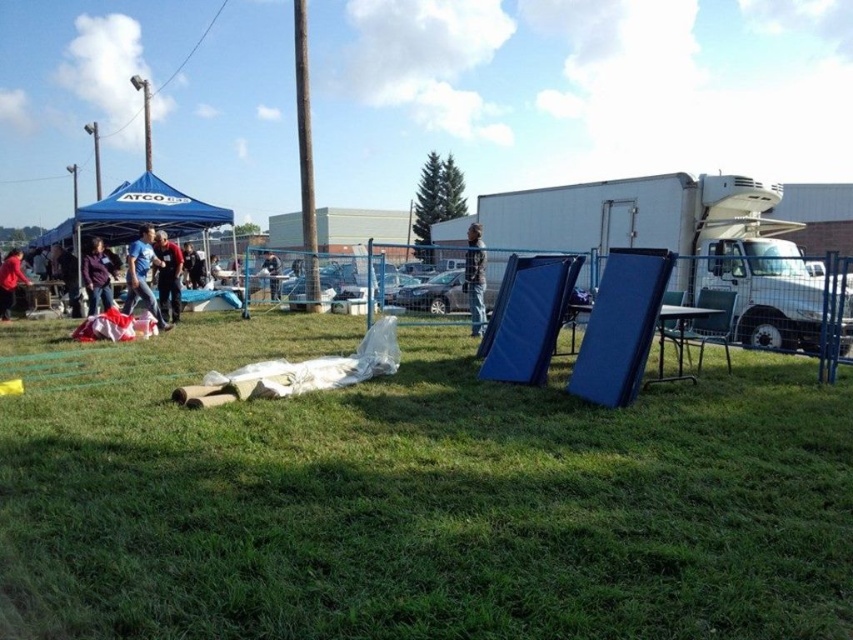
Between green plastic chair at center and dark blue jeans at center, which one appears on the left side from the viewer's perspective?

From the viewer's perspective, dark blue jeans at center appears more on the left side.

Measure the distance between point (692,326) and camera.

A distance of 7.85 meters exists between point (692,326) and camera.

Find the location of `green plastic chair at center`. green plastic chair at center is located at coordinates (701, 324).

Is blue fabric at left to the left of matte black jacket at left from the viewer's perspective?

No, blue fabric at left is not to the left of matte black jacket at left.

Which is behind, point (142, 253) or point (56, 243)?

Positioned behind is point (56, 243).

Identify the location of blue fabric at left. (142, 275).

Is point (740, 508) closer to viewer compared to point (474, 224)?

Yes, point (740, 508) is closer to viewer.

Can you confirm if green grassy at center is positioned to the left of blue plaid shirt at center?

Correct, you'll find green grassy at center to the left of blue plaid shirt at center.

Is point (309, 616) positioned behind point (468, 243)?

No.

This screenshot has height=640, width=853. I want to click on green grassy at center, so click(413, 497).